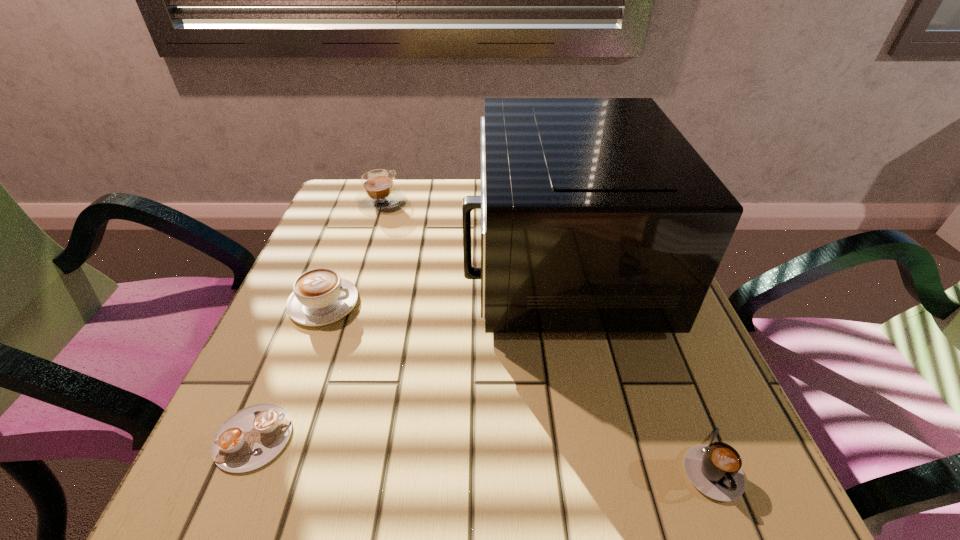
At what (x,y) coordinates should I click in order to perform the action: click on object located in the far right corner section of the desktop. Please return your answer as a coordinate pair (x, y). The height and width of the screenshot is (540, 960). Looking at the image, I should click on (597, 215).

Where is `object situated at the near right corner`? This screenshot has height=540, width=960. object situated at the near right corner is located at coordinates (715, 470).

This screenshot has height=540, width=960. I want to click on free space at the far edge of the desktop, so click(x=417, y=180).

In the image, there is a desktop. Identify the location of free space at the left edge. The width and height of the screenshot is (960, 540). (263, 334).

The width and height of the screenshot is (960, 540). I want to click on free point at the right edge, so click(616, 347).

The height and width of the screenshot is (540, 960). Find the location of `free space at the far left corner`. free space at the far left corner is located at coordinates (360, 184).

Locate an element on the screen. This screenshot has height=540, width=960. vacant space that's between the second tallest object and the second tallest cappuccino is located at coordinates pos(352,252).

Locate an element on the screen. vacant area between the shortest object and the tallest object is located at coordinates (406, 349).

Where is `vacant space that's between the shortest cappuccino and the rightmost cappuccino`? vacant space that's between the shortest cappuccino and the rightmost cappuccino is located at coordinates (481, 450).

The width and height of the screenshot is (960, 540). What are the coordinates of `free point between the rightmost cappuccino and the second tallest cappuccino` in the screenshot? It's located at point(516,383).